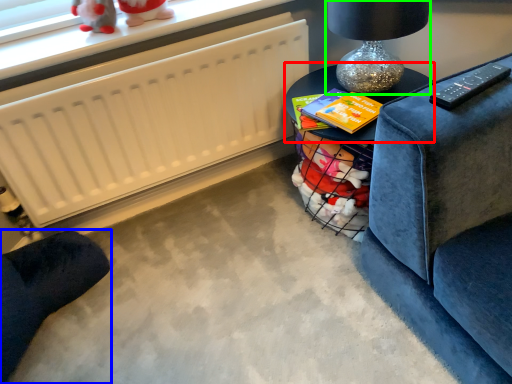
Question: Estimate the real-world distances between objects in this image. Which object is closer to table (highlighted by a red box), furniture (highlighted by a blue box) or table lamp (highlighted by a green box)?

Choices:
 (A) furniture
 (B) table lamp

Answer: (B)